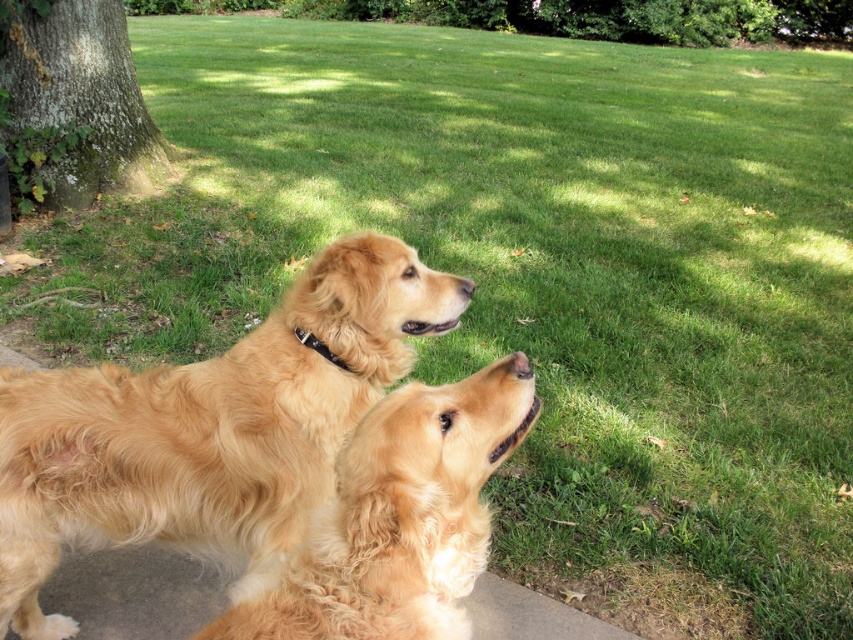
From the picture: Between golden fur dog at upper left and green mossy bark at left, which one is positioned lower?

golden fur dog at upper left

Can you confirm if golden fur dog at upper left is positioned below green mossy bark at left?

Correct, golden fur dog at upper left is located below green mossy bark at left.

Is point (248, 378) positioned in front of point (83, 156)?

Yes.

Find the location of a particular element. The image size is (853, 640). golden fur dog at upper left is located at coordinates (207, 428).

Which is more to the left, golden fur dog at upper left or golden fluffy dog at center?

golden fur dog at upper left is more to the left.

Measure the distance between golden fur dog at upper left and camera.

golden fur dog at upper left and camera are 5.91 feet apart.

Is point (263, 502) closer to camera compared to point (310, 556)?

That is False.

At what (x,y) coordinates should I click in order to perform the action: click on golden fur dog at upper left. Please return your answer as a coordinate pair (x, y). The width and height of the screenshot is (853, 640). Looking at the image, I should click on (207, 428).

Is point (53, 64) farther from viewer compared to point (328, 360)?

Yes, point (53, 64) is farther from viewer.

Which is in front, point (82, 70) or point (329, 356)?

Point (329, 356)

Measure the distance between green mossy bark at left and camera.

5.45 meters

Where is `green mossy bark at left`? Image resolution: width=853 pixels, height=640 pixels. green mossy bark at left is located at coordinates (74, 102).